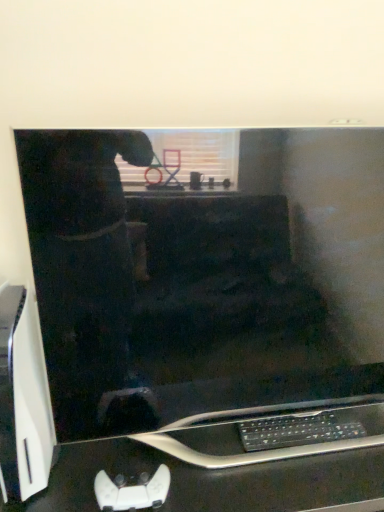
Image resolution: width=384 pixels, height=512 pixels. Find the location of `free space on the front side of black plastic keyboard at lower center`. free space on the front side of black plastic keyboard at lower center is located at coordinates (307, 478).